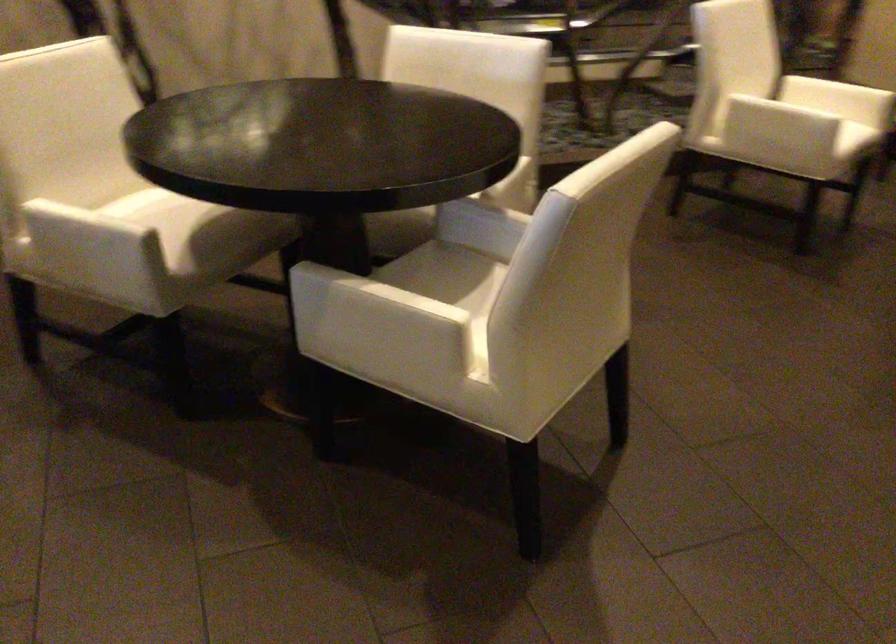
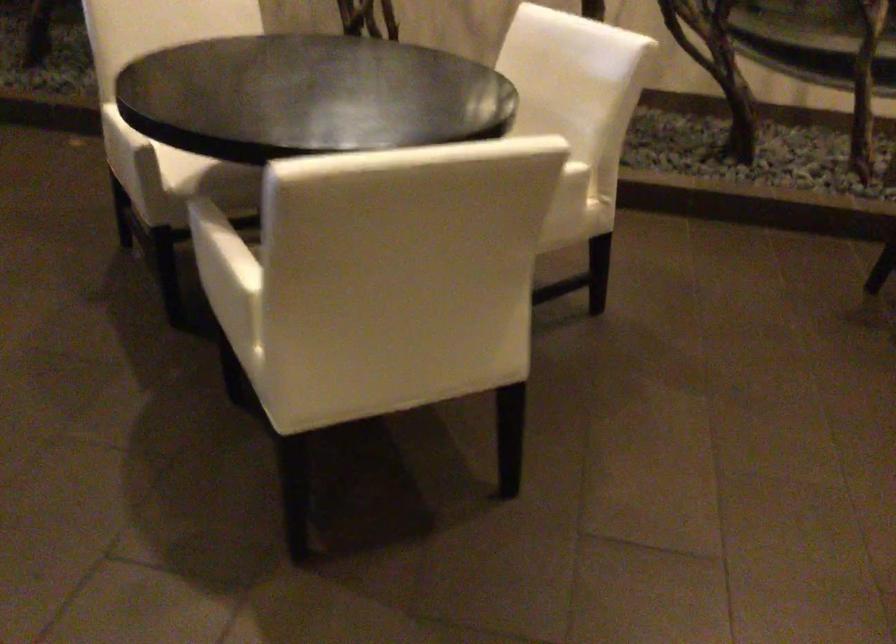
The point at (104, 239) is marked in the first image. Where is the corresponding point in the second image?

(118, 138)